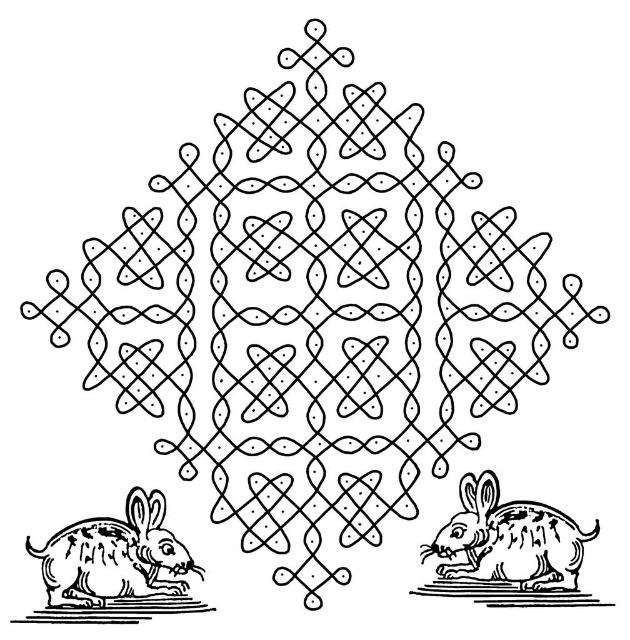
Question: Which object is farther from the camera taking this photo?

Choices:
 (A) speckled fur rabbit at lower left
 (B) speckled fur rabbit at lower right

Answer: (B)

Question: In this image, where is speckled fur rabbit at lower left located relative to speckled fur rabbit at lower right?

Choices:
 (A) above
 (B) below

Answer: (B)

Question: Does speckled fur rabbit at lower left appear under speckled fur rabbit at lower right?

Choices:
 (A) no
 (B) yes

Answer: (B)

Question: Which of the following is the closest to the observer?

Choices:
 (A) speckled fur rabbit at lower left
 (B) speckled fur rabbit at lower right

Answer: (A)

Question: Which of the following is the farthest from the observer?

Choices:
 (A) speckled fur rabbit at lower right
 (B) speckled fur rabbit at lower left

Answer: (A)

Question: Does speckled fur rabbit at lower left lie behind speckled fur rabbit at lower right?

Choices:
 (A) no
 (B) yes

Answer: (A)